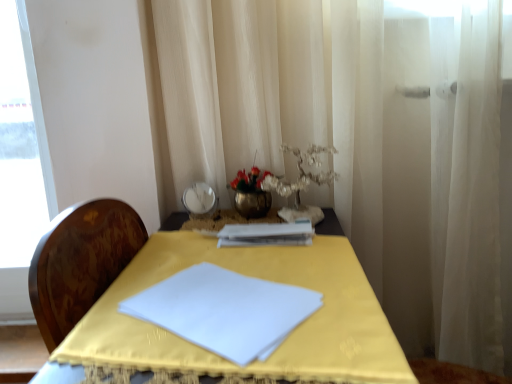
Image resolution: width=512 pixels, height=384 pixels. Find the location of `free space on the front side of white paper journal at center`. free space on the front side of white paper journal at center is located at coordinates (266, 265).